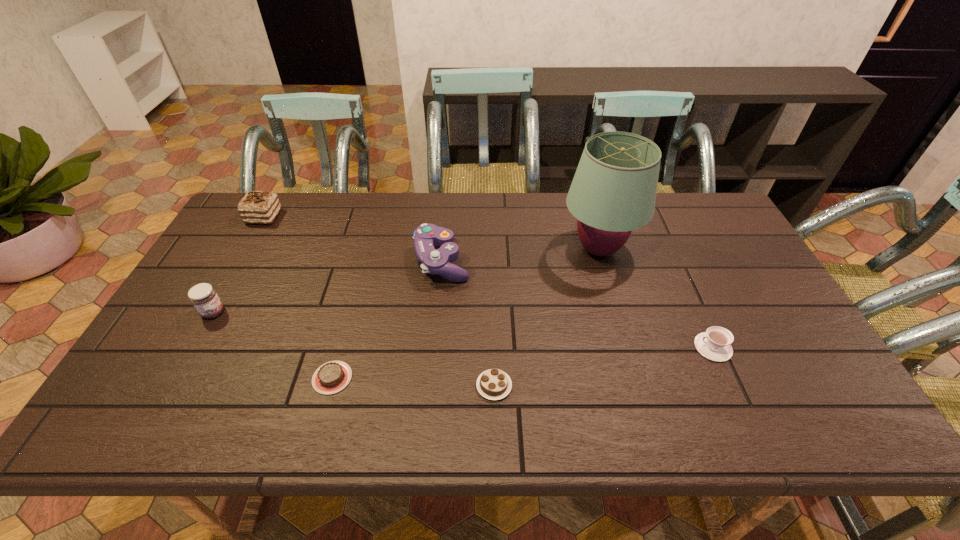
Locate an element on the screen. This screenshot has width=960, height=540. lampshade is located at coordinates (613, 192).

Find the location of a particular element. The width and height of the screenshot is (960, 540). the sixth object from left to right is located at coordinates (613, 192).

The width and height of the screenshot is (960, 540). Find the location of `the fourth object from right to left`. the fourth object from right to left is located at coordinates [x=434, y=261].

What are the coordinates of `the tallest chocolate cake` in the screenshot? It's located at (257, 207).

Identify the location of the farthest chocolate cake. (257, 207).

This screenshot has width=960, height=540. Identify the location of jam. (204, 298).

Where is `the rightmost object`? The height and width of the screenshot is (540, 960). the rightmost object is located at coordinates click(714, 344).

Locate an element on the screen. Image resolution: width=960 pixels, height=540 pixels. teacup is located at coordinates (714, 344).

Where is `the third object from right to left`? the third object from right to left is located at coordinates (494, 384).

Identify the location of the third object from left to right. The width and height of the screenshot is (960, 540). (331, 377).